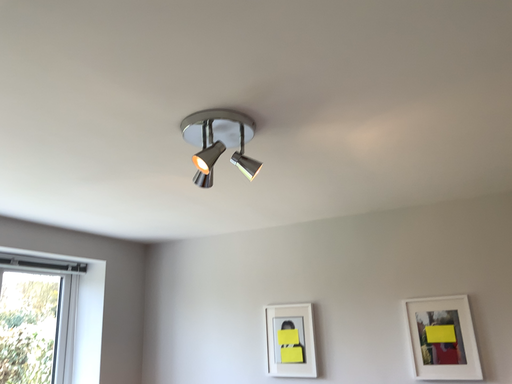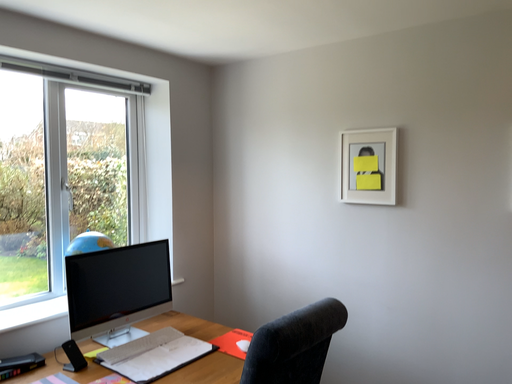
Question: How did the camera likely rotate when shooting the video?

Choices:
 (A) rotated left
 (B) rotated right

Answer: (A)